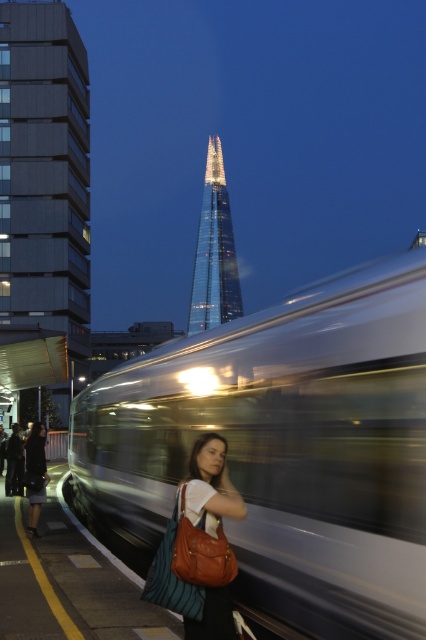
Can you confirm if silver metallic train at center is positioned below black fabric skirt at lower left?

No, silver metallic train at center is not below black fabric skirt at lower left.

Between silver metallic train at center and black fabric skirt at lower left, which one appears on the left side from the viewer's perspective?

From the viewer's perspective, black fabric skirt at lower left appears more on the left side.

Between point (342, 358) and point (40, 465), which one is positioned in front?

Point (342, 358) is more forward.

Identify the location of silver metallic train at center. pyautogui.click(x=284, y=449).

Does shiny glass tower at center appear on the left side of black fabric skirt at lower left?

Indeed, shiny glass tower at center is positioned on the left side of black fabric skirt at lower left.

Describe the element at coordinates (215, 252) in the screenshot. I see `shiny glass tower at center` at that location.

Locate an element on the screen. shiny glass tower at center is located at coordinates (215, 252).

Between gray concrete building at upper left and black fabric skirt at lower left, which one is positioned higher?

gray concrete building at upper left is above.

Which is below, gray concrete building at upper left or black fabric skirt at lower left?

black fabric skirt at lower left

Who is more forward, (x=14, y=264) or (x=40, y=433)?

Point (x=40, y=433) is more forward.

Find the location of a particular element. The height and width of the screenshot is (640, 426). gray concrete building at upper left is located at coordinates (45, 179).